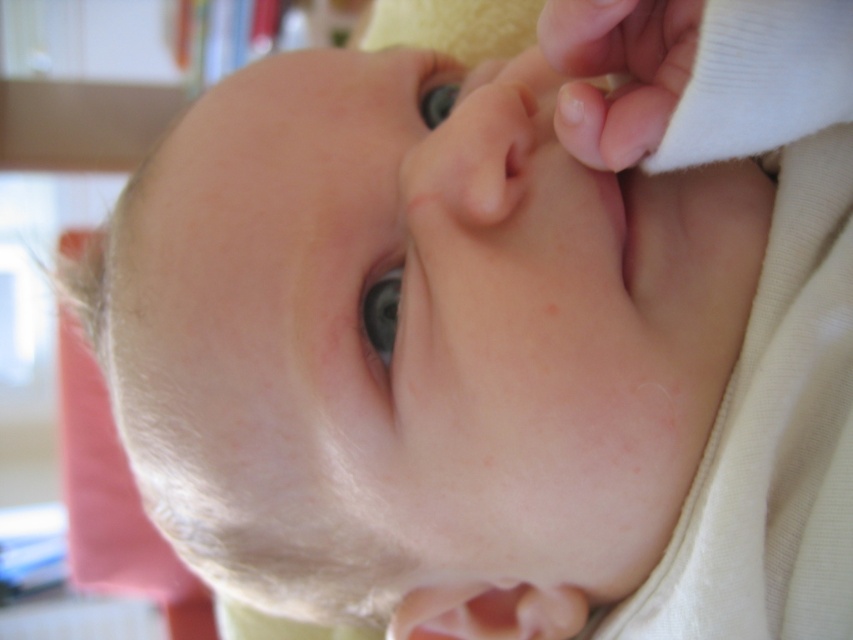
Question: Which point is closer to the camera?

Choices:
 (A) (439, 90)
 (B) (379, 317)
 (C) (405, 172)

Answer: (B)

Question: Does smooth flesh nose at center have a larger size compared to blue glossy eye at center?

Choices:
 (A) no
 (B) yes

Answer: (B)

Question: Is smooth flesh nose at center further to camera compared to blue glossy eye at upper center?

Choices:
 (A) yes
 (B) no

Answer: (B)

Question: Which point appears closest to the camera in this image?

Choices:
 (A) (428, 122)
 (B) (381, 307)
 (C) (656, 113)
 (D) (494, 180)

Answer: (C)

Question: Among these objects, which one is nearest to the camera?

Choices:
 (A) blue glossy eye at upper center
 (B) smooth skin hand at upper right

Answer: (B)

Question: Does smooth skin hand at upper right come behind blue glossy eye at center?

Choices:
 (A) no
 (B) yes

Answer: (A)